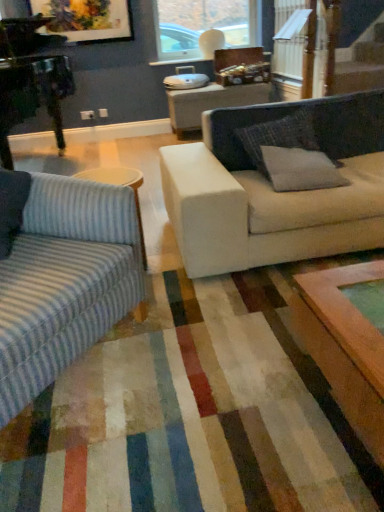
Where is `vacant area that lies to the right of striped fabric couch at left`? This screenshot has width=384, height=512. vacant area that lies to the right of striped fabric couch at left is located at coordinates (207, 365).